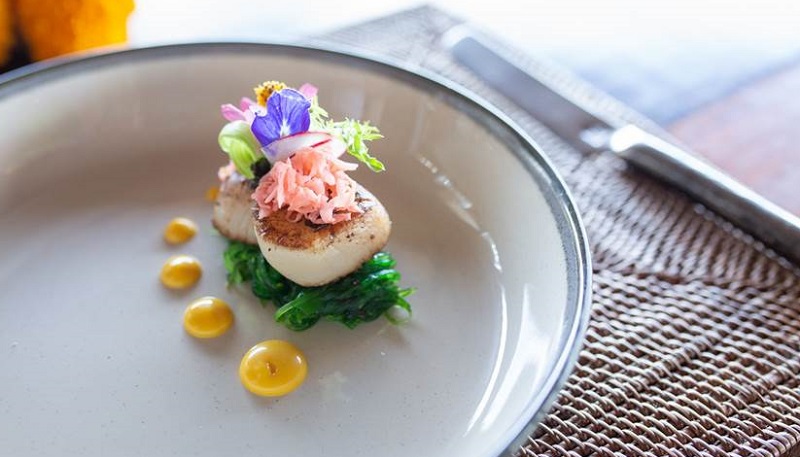
Locate an element on the screen. Image resolution: width=800 pixels, height=457 pixels. blue rim of bowl is located at coordinates 574,266.